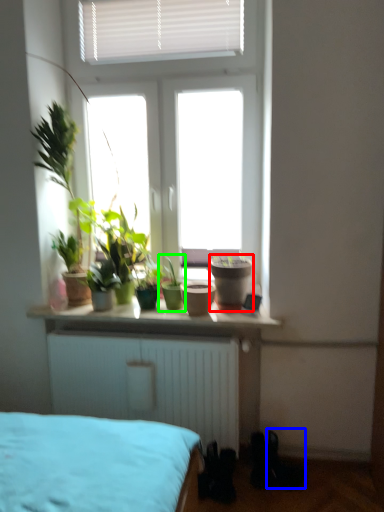
Question: Which object is positioned closest to flowerpot (highlighted by a red box)? Select from shoe (highlighted by a blue box) and houseplant (highlighted by a green box).

Choices:
 (A) shoe
 (B) houseplant

Answer: (B)